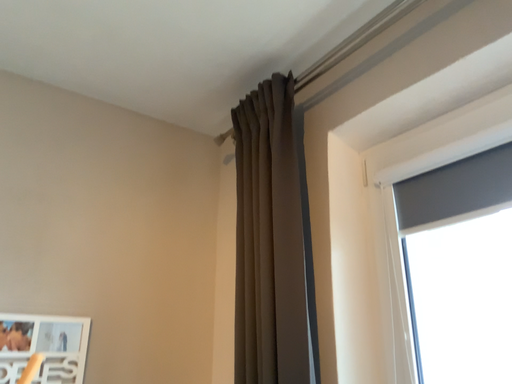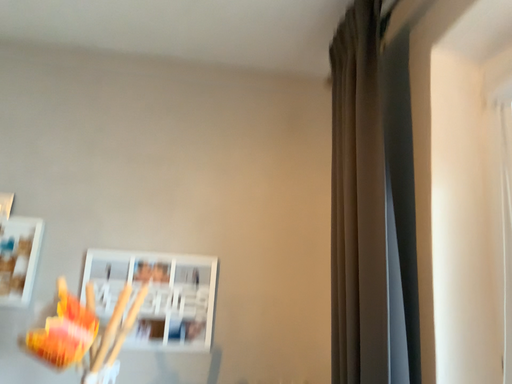
Question: Which way did the camera rotate in the video?

Choices:
 (A) rotated left
 (B) rotated right

Answer: (A)